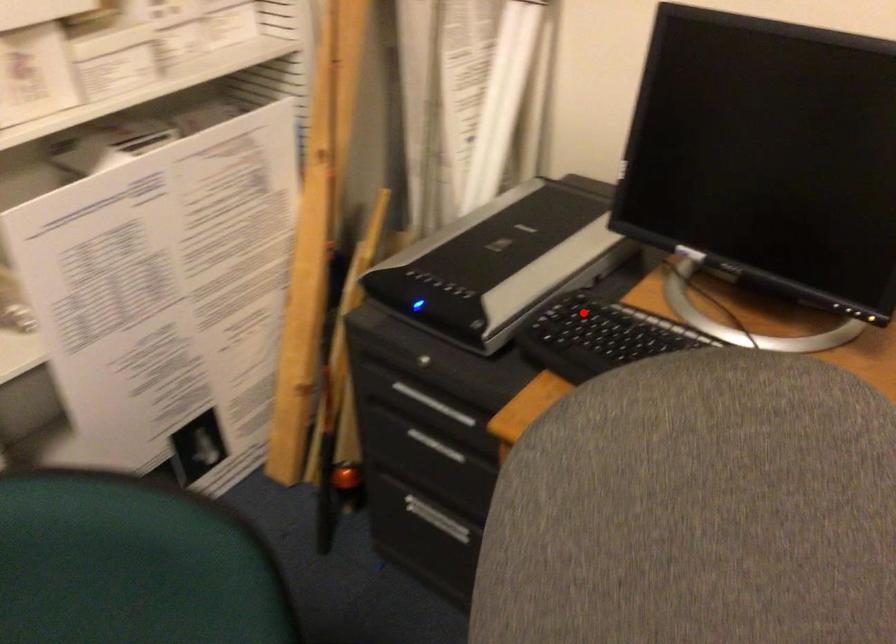
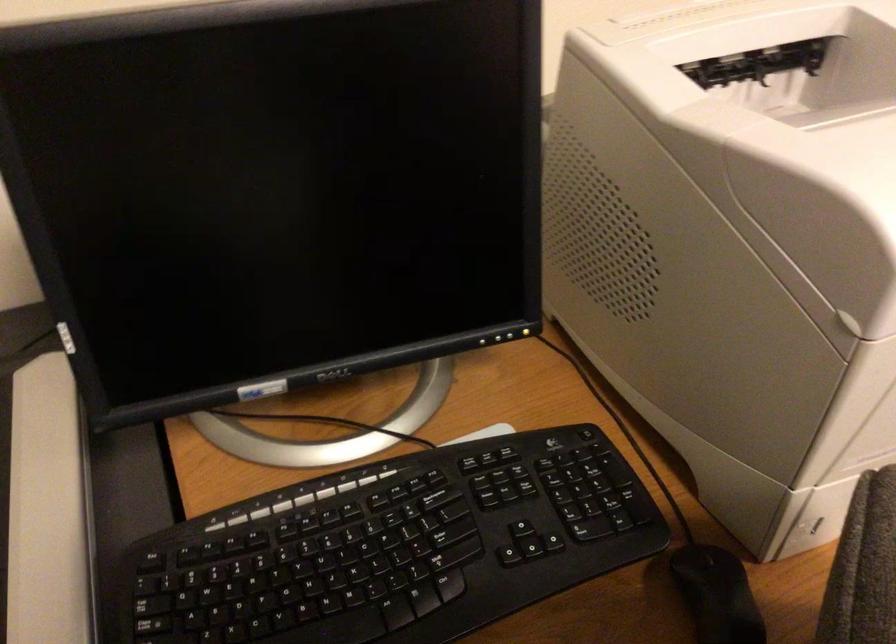
Find the pixel in the second image that matches the highlighted location in the first image.

(178, 585)